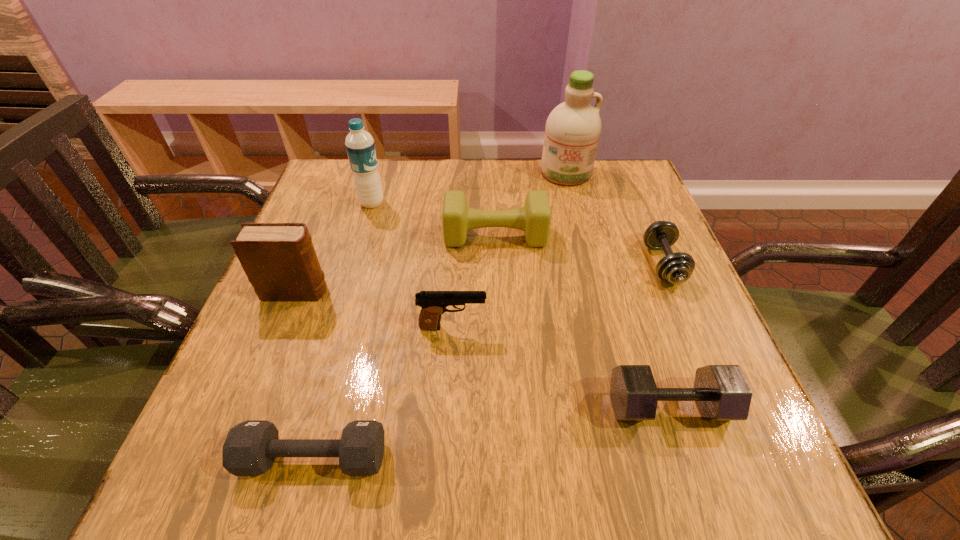
Where is `cleansing agent`? The height and width of the screenshot is (540, 960). cleansing agent is located at coordinates pyautogui.click(x=573, y=128).

Where is `the tallest object`? the tallest object is located at coordinates (573, 128).

I want to click on the second tallest object, so click(360, 146).

You are a GUI agent. You are given a task and a screenshot of the screen. Output one action in this format:
    pyautogui.click(x=<x>, y=<y>)
    Task: Click on the water bottle
    The height and width of the screenshot is (540, 960).
    Given the screenshot: What is the action you would take?
    pyautogui.click(x=360, y=146)

Locate an element on the screen. Image resolution: width=960 pixels, height=540 pixels. the third tallest object is located at coordinates (279, 259).

The width and height of the screenshot is (960, 540). In order to click on the second dumbbell from left to right in this screenshot , I will do `click(534, 218)`.

You are a GUI agent. You are given a task and a screenshot of the screen. Output one action in this format:
    pyautogui.click(x=<x>, y=<y>)
    Task: Click on the pistol
    The image size is (960, 540).
    Given the screenshot: What is the action you would take?
    tap(433, 304)

Locate an element on the screen. This screenshot has width=960, height=540. the second nearest dumbbell is located at coordinates click(722, 393).

The image size is (960, 540). I want to click on the nearest object, so click(250, 448).

This screenshot has width=960, height=540. In order to click on the leftmost dumbbell in this screenshot , I will do `click(250, 448)`.